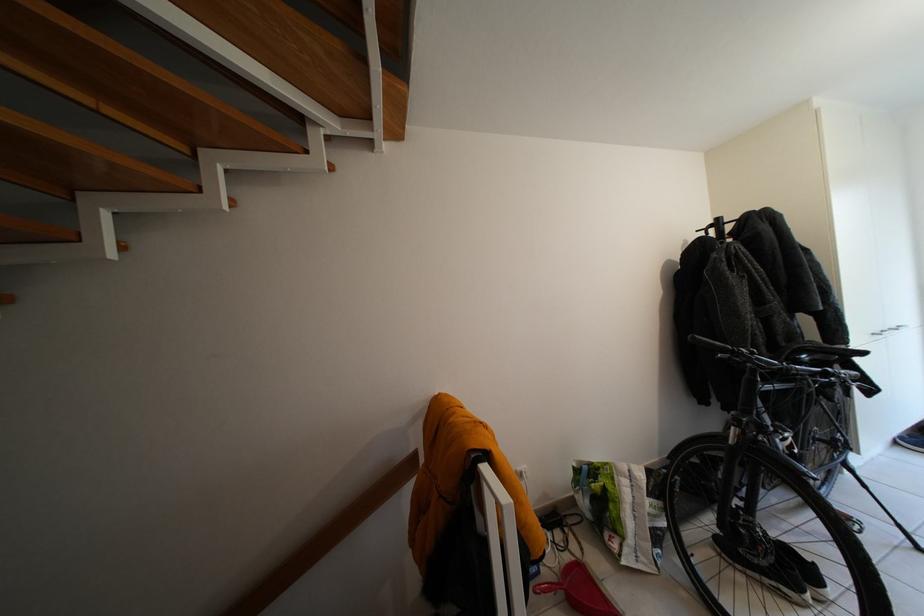
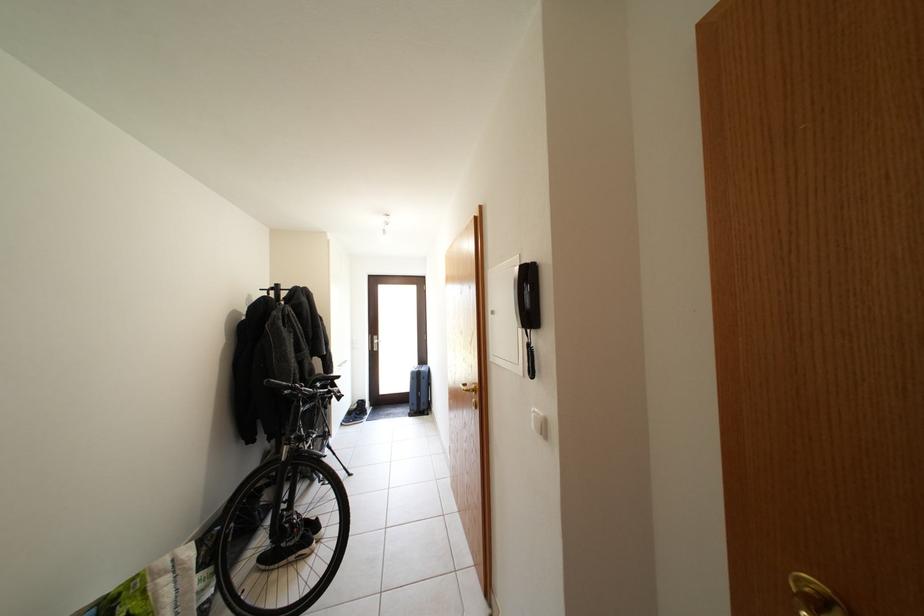
In the second image, find the point that corresponds to (719,232) in the first image.

(281, 294)